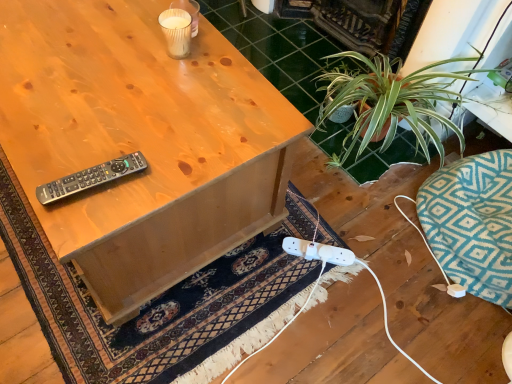
Locate an element on the screen. This screenshot has width=512, height=384. free space to the back side of black plastic remote at upper left is located at coordinates (113, 124).